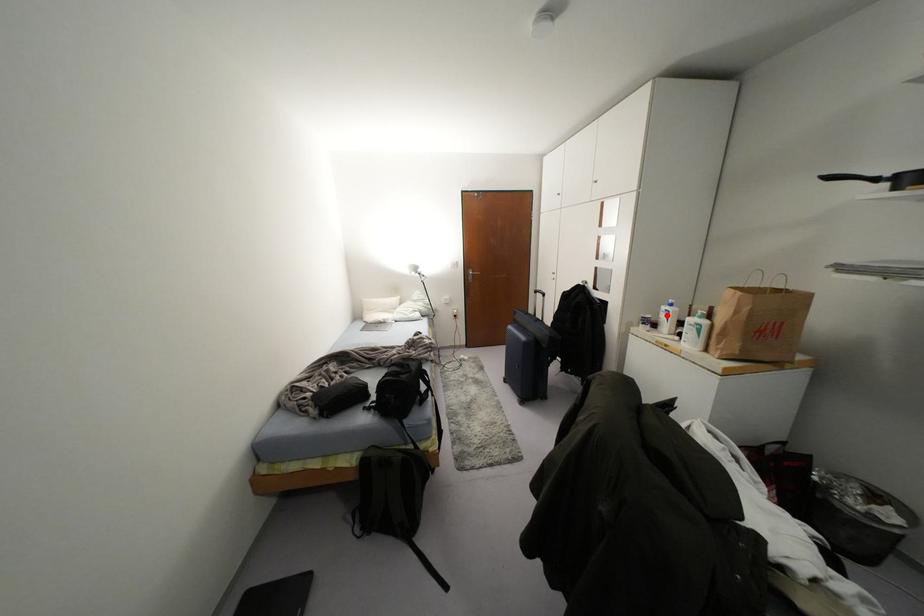
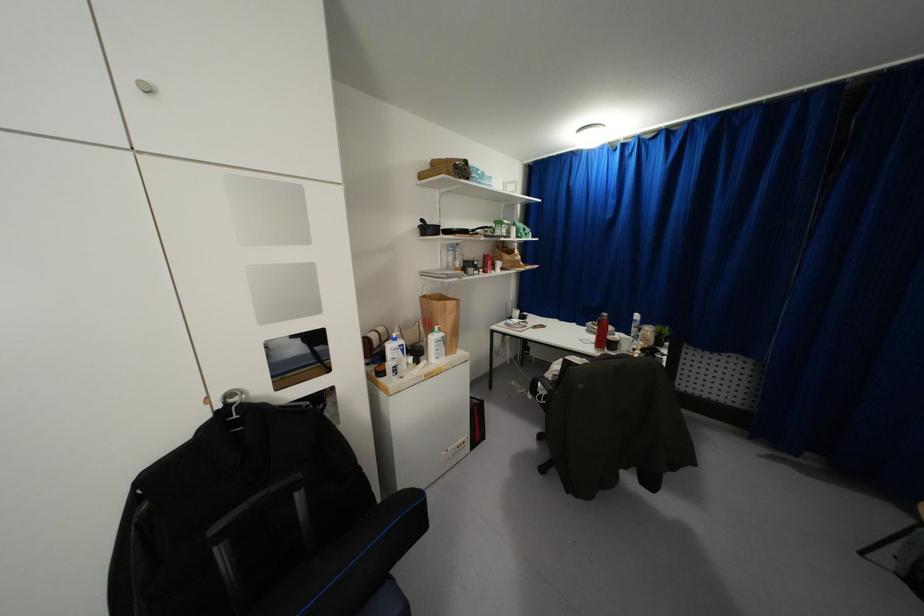
Where in the second image is the point corresponding to the highlighted location from the first image?

(402, 350)